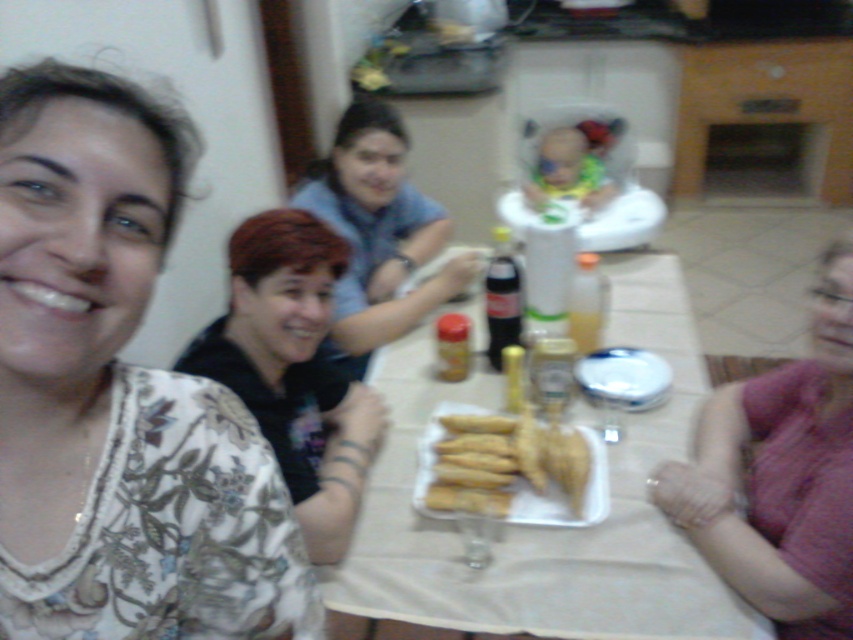
Is floral print blouse at left in front of pink fabric at lower right?

Yes, floral print blouse at left is in front of pink fabric at lower right.

Find the location of a particular element. floral print blouse at left is located at coordinates click(119, 394).

This screenshot has width=853, height=640. Find the location of `floral print blouse at left`. floral print blouse at left is located at coordinates (119, 394).

Between pink fabric at lower right and golden crispy pastry at center, which one is positioned lower?

golden crispy pastry at center is below.

Can you confirm if pink fabric at lower right is positioned above golden crispy pastry at center?

Yes.

Where is `pink fabric at lower right`? This screenshot has height=640, width=853. pink fabric at lower right is located at coordinates (780, 474).

Which is behind, point (799, 372) or point (631, 394)?

Positioned behind is point (631, 394).

The image size is (853, 640). I want to click on pink fabric at lower right, so click(x=780, y=474).